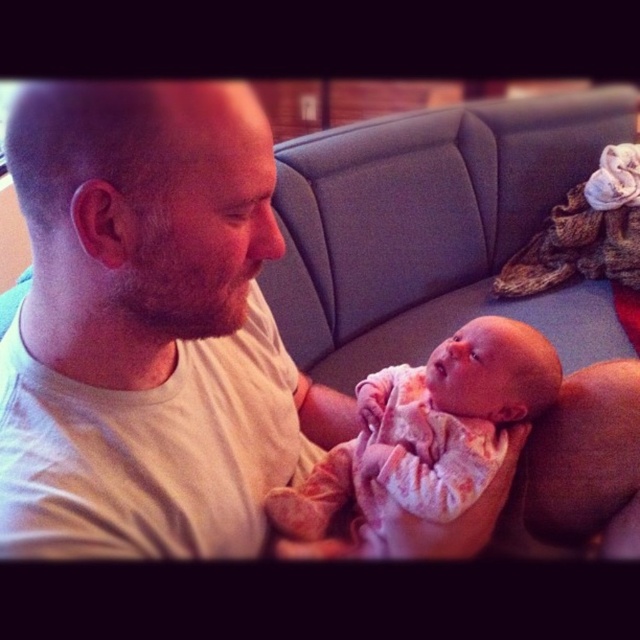
You are standing in a room with a warm, reddish light. You see a gray couch with a textured backrest and a decorative element on its right side. A man in a white matte t shirt is sitting on the couch holding a baby in a pink and white outfit. There is a specific point marked at coordinates (147,326). Can you identify which object is exactly at that point?

The white matte t shirt at center is exactly at point (147,326).